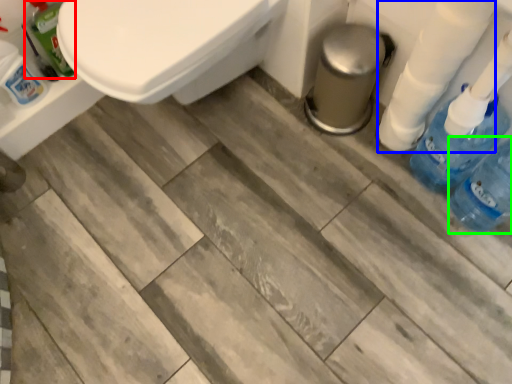
Question: Based on their relative distances, which object is farther from cleaning product (highlighted by a red box)? Choose from toilet paper (highlighted by a blue box) and bottle (highlighted by a green box).

Choices:
 (A) toilet paper
 (B) bottle

Answer: (B)